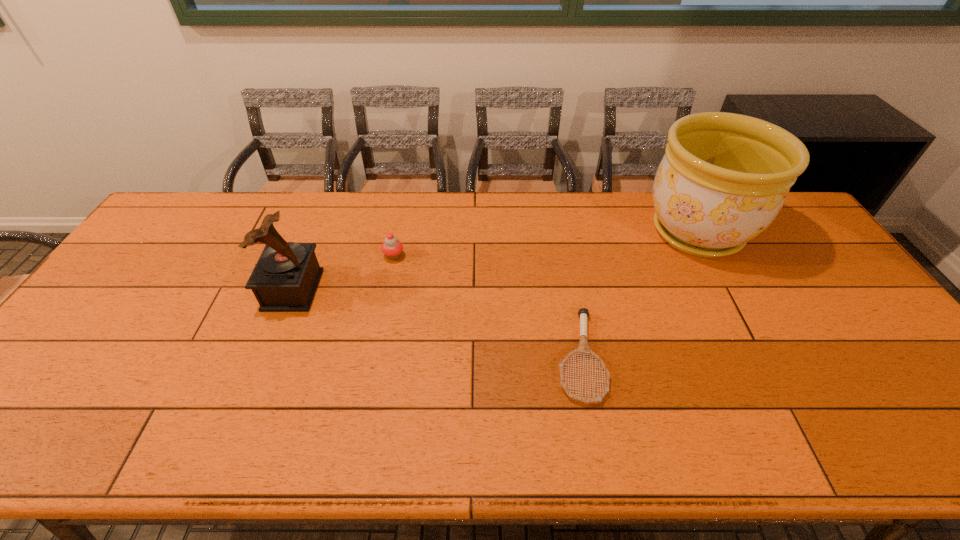
Locate an element on the screen. This screenshot has width=960, height=540. vacant space that satisfies the following two spatial constraints: 1. at the horn opening of the nearest object; 2. on the right side of the second tallest object is located at coordinates [x=266, y=356].

Locate an element on the screen. vacant space that satisfies the following two spatial constraints: 1. on the front side of the second object from left to right; 2. on the right side of the tennis racket is located at coordinates (373, 356).

Image resolution: width=960 pixels, height=540 pixels. I want to click on vacant space that satisfies the following two spatial constraints: 1. at the horn opening of the phonograph_record; 2. on the left side of the nearest object, so click(266, 356).